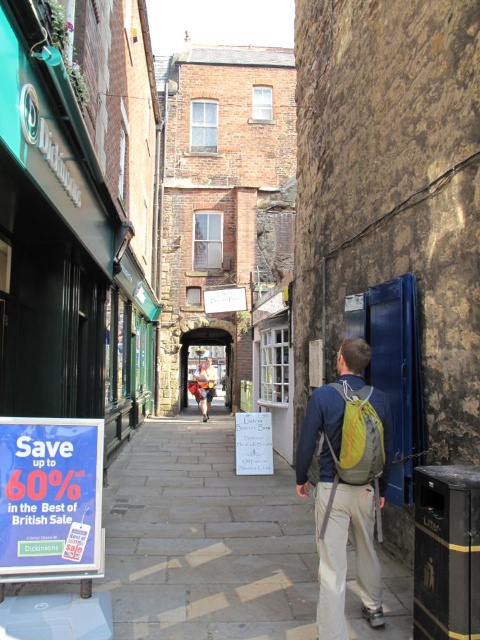
You are a traveler carrying a green fabric backpack at center and wearing camouflage shorts at center. You need to pass through a narrow alleyway. Which item might be easier to maneuver through tight spaces due to its size?

The green fabric backpack at center has a lesser width compared to camouflage shorts at center, so it would be easier to maneuver through tight spaces.

You are a delivery person carrying a green fabric backpack at center and need to pass through the narrow alleyway. There is a blue paper sign at lower left hanging from a pole. Can you fit through the space between the sign and the wall without touching either?

The blue paper sign at lower left is wider than the green fabric backpack at center. Since the alley is narrow, the sign may obstruct your path. To determine if you can pass, measure the distance between the sign and the wall. If it is wider than the backpack, you can fit through without touching either.

You are a delivery person carrying a box that is 1 meter tall. You need to walk through the alley and pass between the paved stone pavement at lower center and the blue paper sign at lower left. Will your box fit through without hitting anything?

The paved stone pavement at lower center has a lesser height compared to blue paper sign at lower left. Since the paved stone pavement is shorter, the blue paper sign at lower left is taller. The box is 1 meter tall, so if the blue paper sign at lower left is taller than 1 meter, the box will fit. However, since the height difference isn